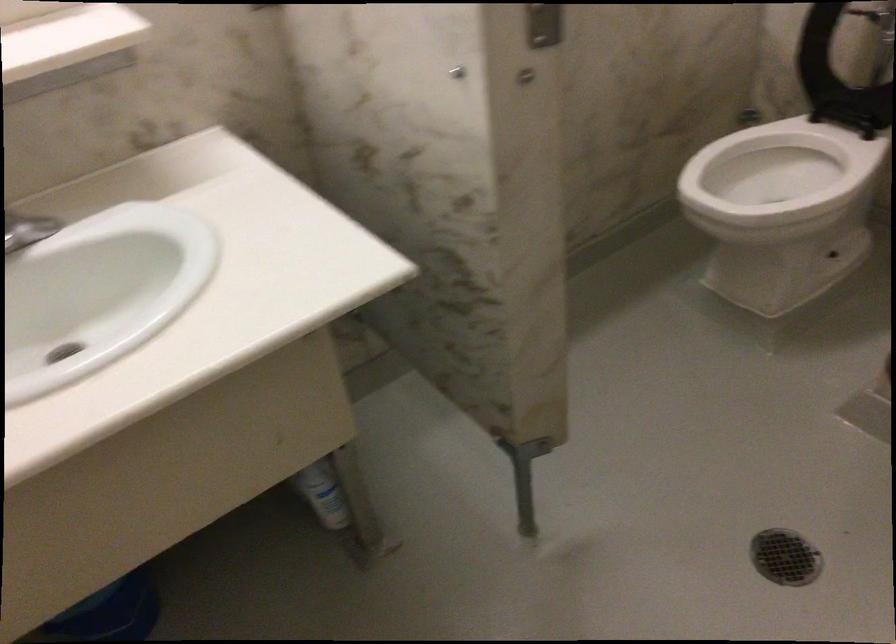
The height and width of the screenshot is (644, 896). I want to click on silver faucet handle, so click(27, 230).